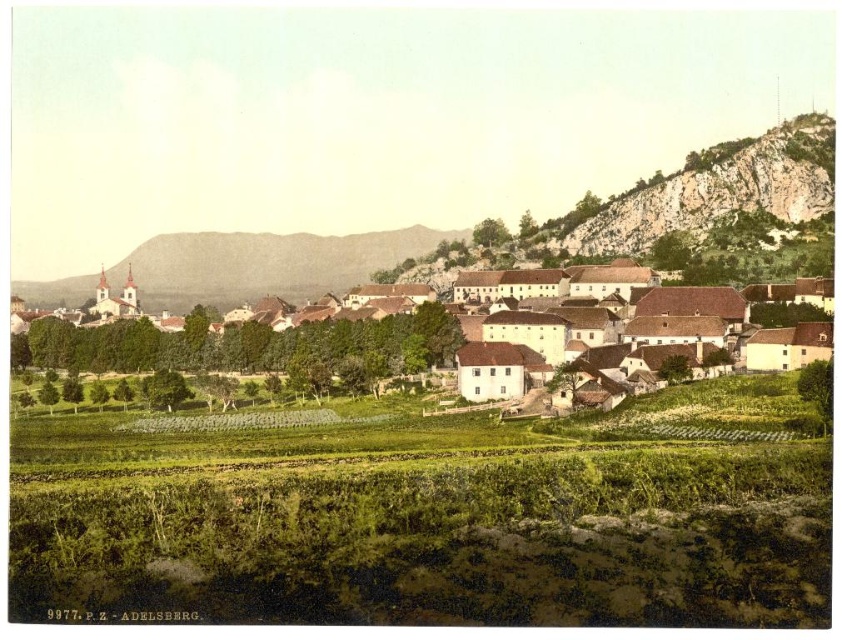
You are a tourist visiting this historical village and want to take a photo of the white matte buildings at center and the green grassy vineyard at center. From which direction should you stand to ensure both are visible in the frame?

The green grassy vineyard at center is located below the white matte buildings at center, so you should stand facing the buildings from a position where the vineyard is visible below them. This could be from a higher vantage point or directly in front to include both in the frame.

You are standing in the village square and want to take a photo of the green grassy vineyard at center and the white matte buildings at center. Which one should you focus on first to ensure both are in sharp focus?

Since the green grassy vineyard at center is closer to the viewer than the white matte buildings at center, you should focus on the green grassy vineyard at center first. This ensures the foreground is sharp, and the buildings in the background will also be in focus due to the depth of field.